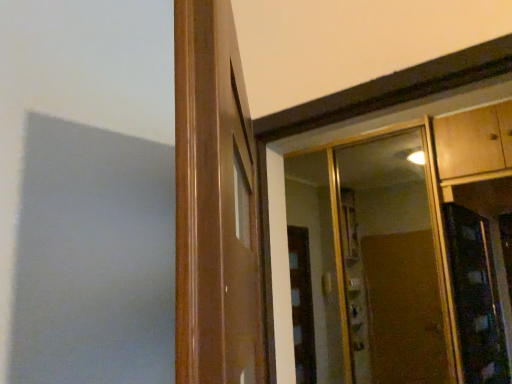
The image size is (512, 384). What do you see at coordinates (474, 141) in the screenshot?
I see `wooden cabinet at upper right` at bounding box center [474, 141].

Locate an element on the screen. The height and width of the screenshot is (384, 512). wooden cabinet at upper right is located at coordinates (474, 141).

Is wooden cabinet at upper right inside the boundaries of wooden door frame at center, or outside?

wooden cabinet at upper right lies outside wooden door frame at center.

Which is nearer, (443, 142) or (203, 82)?

Point (443, 142) appears to be farther away from the viewer than point (203, 82).

Is the surface of wooden cabinet at upper right in direct contact with wooden door frame at center?

No, wooden cabinet at upper right is not beside wooden door frame at center.

From the picture: Could you tell me if wooden cabinet at upper right is facing wooden door frame at center?

No, wooden cabinet at upper right is not aimed at wooden door frame at center.

Could you tell me if wooden door frame at center is facing wooden cabinet at upper right?

No, wooden door frame at center is not oriented towards wooden cabinet at upper right.

Is wooden door frame at center at the left side of wooden cabinet at upper right?

Yes, wooden door frame at center is to the left of wooden cabinet at upper right.

Would you say wooden door frame at center is a long distance from wooden cabinet at upper right?

Indeed, wooden door frame at center is not near wooden cabinet at upper right.

From the image's perspective, is wooden door frame at center located above or below wooden cabinet at upper right?

From the image's perspective, wooden door frame at center appears below wooden cabinet at upper right.

Would you say wooden cabinet at upper right is outside clear glass mirror at upper right?

That's correct, wooden cabinet at upper right is outside of clear glass mirror at upper right.

Considering the sizes of objects wooden cabinet at upper right and clear glass mirror at upper right in the image provided, who is thinner, wooden cabinet at upper right or clear glass mirror at upper right?

clear glass mirror at upper right.

Considering the sizes of objects wooden cabinet at upper right and clear glass mirror at upper right in the image provided, who is smaller, wooden cabinet at upper right or clear glass mirror at upper right?

Smaller between the two is clear glass mirror at upper right.

Can you confirm if wooden door frame at center is shorter than clear glass mirror at upper right?

Yes, wooden door frame at center is shorter than clear glass mirror at upper right.

Considering the sizes of wooden door frame at center and clear glass mirror at upper right in the image, is wooden door frame at center wider or thinner than clear glass mirror at upper right?

Clearly, wooden door frame at center has more width compared to clear glass mirror at upper right.

How many degrees apart are the facing directions of wooden door frame at center and clear glass mirror at upper right?

124 degrees.

From a real-world perspective, who is located higher, wooden door frame at center or clear glass mirror at upper right?

clear glass mirror at upper right.

From the picture: From a real-world perspective, is clear glass mirror at upper right positioned under wooden door frame at center based on gravity?

Actually, clear glass mirror at upper right is physically above wooden door frame at center in the real world.

Is clear glass mirror at upper right next to wooden door frame at center?

clear glass mirror at upper right and wooden door frame at center are not in contact.

Is point (340, 254) more distant than point (247, 351)?

That is True.

How many degrees apart are the facing directions of clear glass mirror at upper right and wooden cabinet at upper right?

The angle between the facing direction of clear glass mirror at upper right and the facing direction of wooden cabinet at upper right is 89.6 degrees.

Relative to wooden cabinet at upper right, is clear glass mirror at upper right in front or behind?

clear glass mirror at upper right is positioned farther from the viewer than wooden cabinet at upper right.

From the image's perspective, which one is positioned lower, clear glass mirror at upper right or wooden cabinet at upper right?

clear glass mirror at upper right, from the image's perspective.

Is clear glass mirror at upper right not near wooden cabinet at upper right?

Yes, clear glass mirror at upper right and wooden cabinet at upper right are quite far apart.

You are a GUI agent. You are given a task and a screenshot of the screen. Output one action in this format:
    pyautogui.click(x=<x>, y=<y>)
    Task: Click on the cabinetry above the wooden door frame at center (from a real-world perspective)
    The height and width of the screenshot is (384, 512).
    Given the screenshot: What is the action you would take?
    pyautogui.click(x=474, y=141)

Where is `window frame on the left of wooden cabinet at upper right`? Image resolution: width=512 pixels, height=384 pixels. window frame on the left of wooden cabinet at upper right is located at coordinates (216, 206).

Which object lies further to the anchor point wooden door frame at center, clear glass mirror at upper right or wooden cabinet at upper right?

Based on the image, clear glass mirror at upper right appears to be further to wooden door frame at center.

Considering their positions, is wooden cabinet at upper right positioned closer to clear glass mirror at upper right than wooden door frame at center?

Based on the image, wooden cabinet at upper right appears to be nearer to clear glass mirror at upper right.

Looking at the image, which one is located closer to wooden cabinet at upper right, wooden door frame at center or clear glass mirror at upper right?

clear glass mirror at upper right.

Based on their spatial positions, is wooden cabinet at upper right or clear glass mirror at upper right closer to wooden door frame at center?

wooden cabinet at upper right.

Considering their positions, is wooden door frame at center positioned further to clear glass mirror at upper right than wooden cabinet at upper right?

Based on the image, wooden door frame at center appears to be further to clear glass mirror at upper right.

Which object lies further to the anchor point wooden cabinet at upper right, clear glass mirror at upper right or wooden door frame at center?

wooden door frame at center is further to wooden cabinet at upper right.

This screenshot has width=512, height=384. What are the coordinates of `cabinetry between wooden door frame at center and clear glass mirror at upper right from front to back` in the screenshot? It's located at (474, 141).